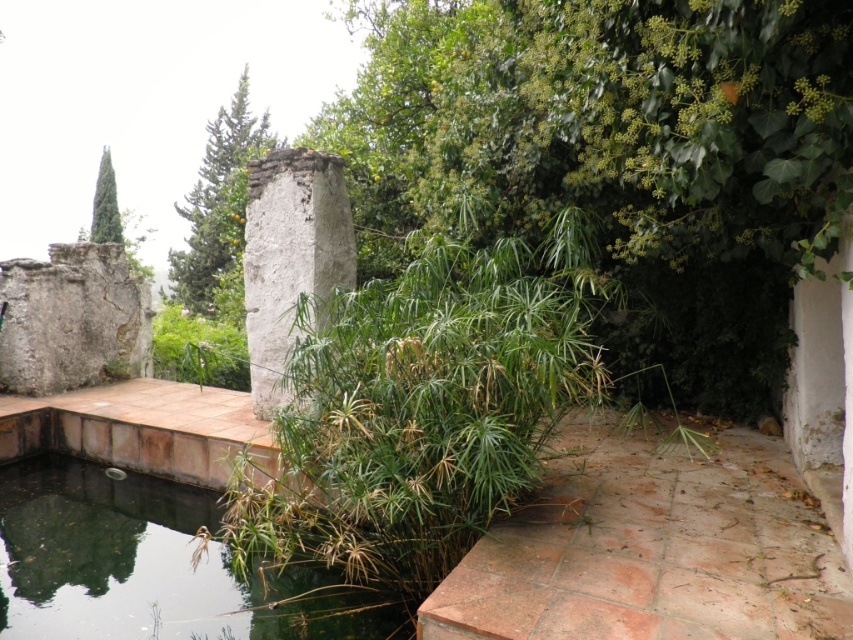
You are a gardener who wants to place a 1.5 meter wide statue between the transparent water at center and the white rough stone pillar at center. Will there be enough space?

The distance between the transparent water at center and the white rough stone pillar at center is 1.80 meters. Since the statue is 1.5 meters wide, there is sufficient space as 1.5 meters is less than 1.80 meters.

You are designing a garden layout and need to place a new decorative statue. The statue is 2 meters wide and must be placed between the transparent water at center and the white rough stone pillar at center. Can the statue fit in the space between them?

The transparent water at center is to the left of the white rough stone pillar at center, but the distance between them isn not specified in the objects description. Therefore, it is impossible to determine if the statue can fit without additional information.

You are standing in the garden and want to take a photo of both the transparent water at center and the white rough stone pillar at center. Which object will appear larger in your photo?

The transparent water at center will appear larger in the photo because it is closer to the viewer than the white rough stone pillar at center.